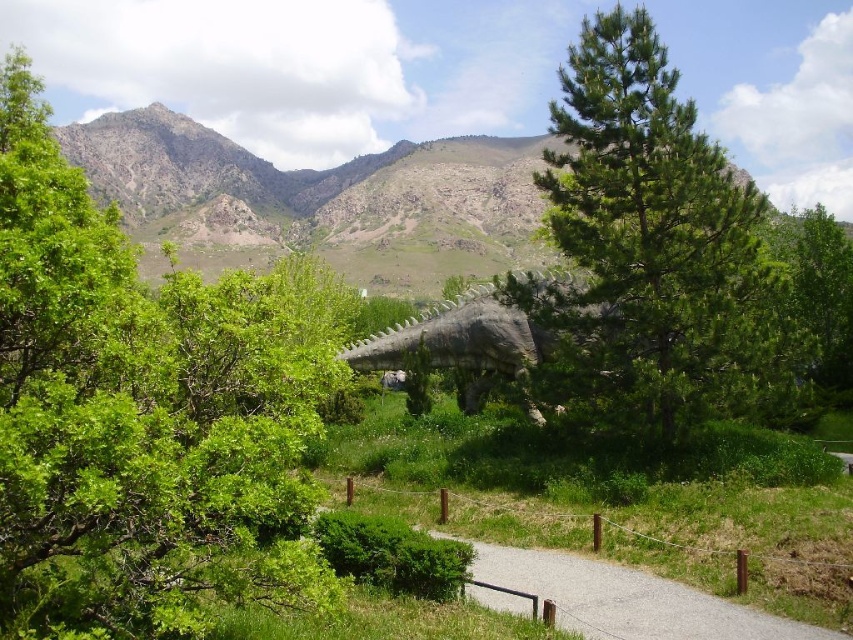
From the picture: Does green leafy tree at upper left have a larger size compared to green needle-like at center?

Indeed, green leafy tree at upper left has a larger size compared to green needle-like at center.

Image resolution: width=853 pixels, height=640 pixels. I want to click on green leafy tree at upper left, so click(x=144, y=413).

Does green leafy tree at upper left have a smaller size compared to gray gravel path at center?

No, green leafy tree at upper left is not smaller than gray gravel path at center.

Between point (51, 400) and point (651, 625), which one is positioned behind?

The point (651, 625) is more distant.

What do you see at coordinates (144, 413) in the screenshot? The width and height of the screenshot is (853, 640). I see `green leafy tree at upper left` at bounding box center [144, 413].

Find the location of a particular element. green leafy tree at upper left is located at coordinates (144, 413).

Does green needle-like at center have a larger size compared to gray gravel path at center?

Indeed, green needle-like at center has a larger size compared to gray gravel path at center.

Which of these two, green needle-like at center or gray gravel path at center, stands shorter?

gray gravel path at center

Is point (564, 228) positioned in front of point (514, 608)?

No, (564, 228) is further to viewer.

The image size is (853, 640). Identify the location of green needle-like at center. click(x=650, y=250).